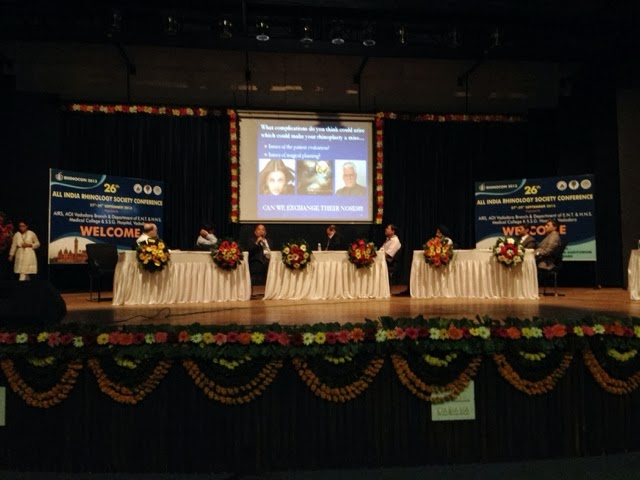
Identify the location of speaker cord. The height and width of the screenshot is (480, 640). (171, 314).